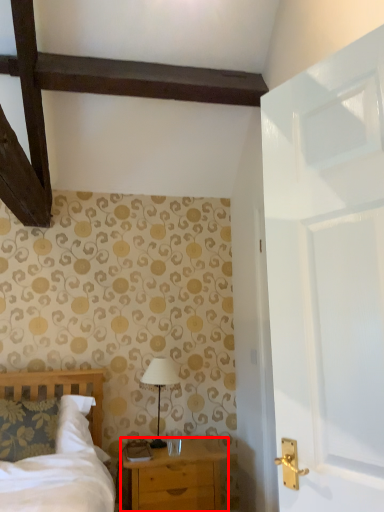
Question: From the image's perspective, considering the relative positions of chest of drawers (annotated by the red box) and table lamp in the image provided, where is chest of drawers (annotated by the red box) located with respect to the staircase?

Choices:
 (A) above
 (B) below

Answer: (B)